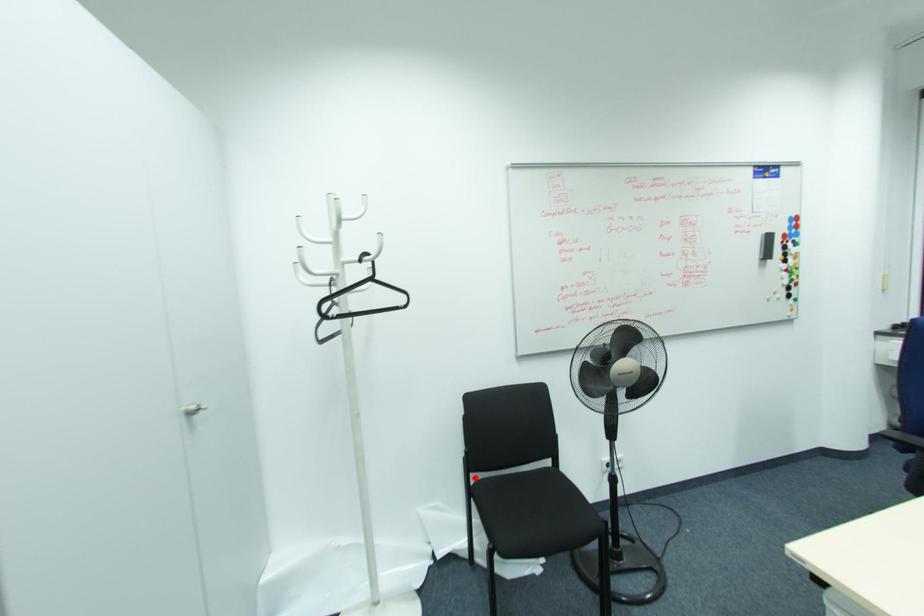
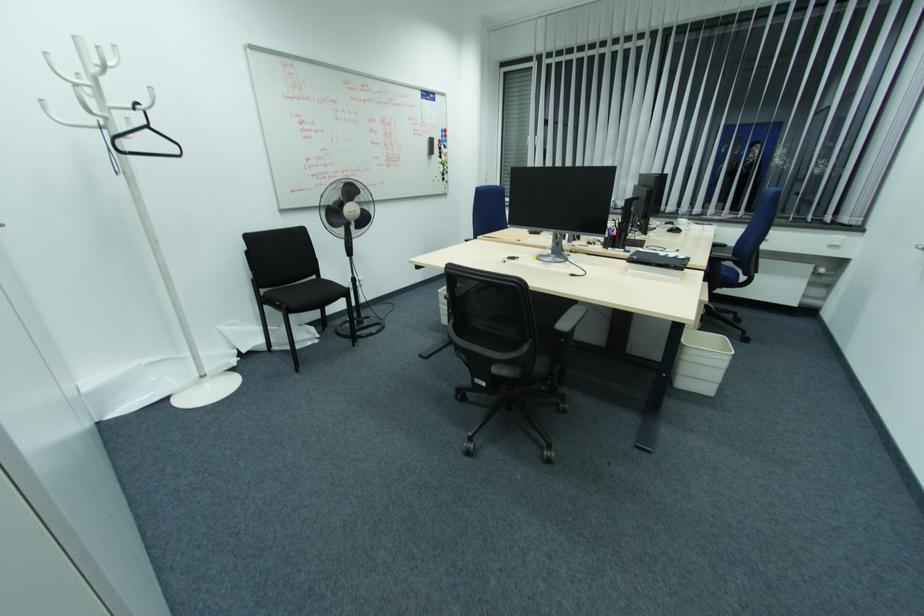
Question: I am providing you with two images of the same scene from different viewpoints. In image1, a red point is highlighted. Considering the same 3D point in image2, which of the following is correct?

Choices:
 (A) It is closer
 (B) It is farther

Answer: (A)